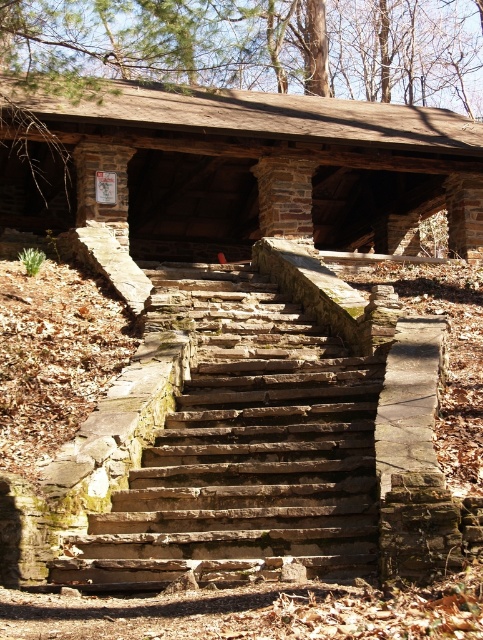
Question: Is rusty stone stairs at center thinner than wooden log cabin at center?

Choices:
 (A) no
 (B) yes

Answer: (B)

Question: Does rusty stone stairs at center appear over wooden log cabin at center?

Choices:
 (A) no
 (B) yes

Answer: (A)

Question: Which point is closer to the camera?

Choices:
 (A) (392, 166)
 (B) (197, 438)

Answer: (B)

Question: Does rusty stone stairs at center have a greater width compared to wooden log cabin at center?

Choices:
 (A) yes
 (B) no

Answer: (B)

Question: Which of the following is the farthest from the observer?

Choices:
 (A) (459, 230)
 (B) (175, 451)

Answer: (A)

Question: Among these points, which one is farthest from the camera?

Choices:
 (A) (83, 173)
 (B) (208, 376)

Answer: (A)